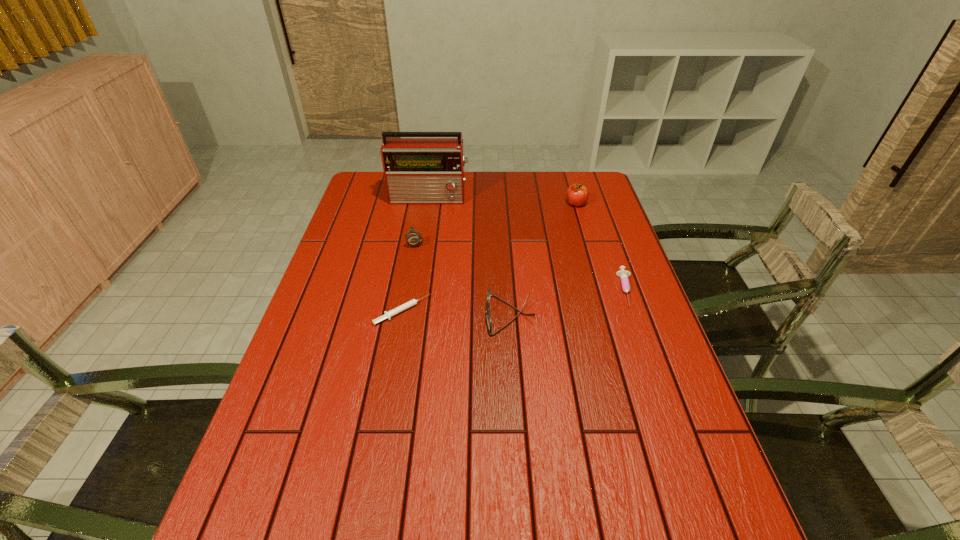
You are a GUI agent. You are given a task and a screenshot of the screen. Output one action in this format:
    pyautogui.click(x=<x>, y=<y>)
    Task: Click on the blank area located 0.250m on the front of the second object from right to left
    This screenshot has height=540, width=960.
    Given the screenshot: What is the action you would take?
    pyautogui.click(x=590, y=254)

This screenshot has height=540, width=960. Identify the location of vacant space located 0.070m on the face of the compass. (411, 262).

Locate an element on the screen. free space located 0.200m on the front-facing side of the spectacles is located at coordinates (411, 315).

The image size is (960, 540). What are the coordinates of `free space located 0.180m on the front-facing side of the spectacles` in the screenshot? It's located at (419, 315).

This screenshot has height=540, width=960. What are the coordinates of `vacant space located on the front-facing side of the spectacles` in the screenshot? It's located at (455, 315).

At what (x,y) coordinates should I click in order to perform the action: click on free space located on the back of the rightmost object. Please return your answer as a coordinate pair (x, y). Looking at the image, I should click on (607, 232).

Locate an element on the screen. free space located on the right of the shortest object is located at coordinates (550, 311).

Locate an element on the screen. radio receiver present at the far edge is located at coordinates (417, 170).

Identify the location of apple that is at the far edge. The height and width of the screenshot is (540, 960). (577, 194).

Locate an element on the screen. Image resolution: width=960 pixels, height=540 pixels. object present at the left edge is located at coordinates (417, 170).